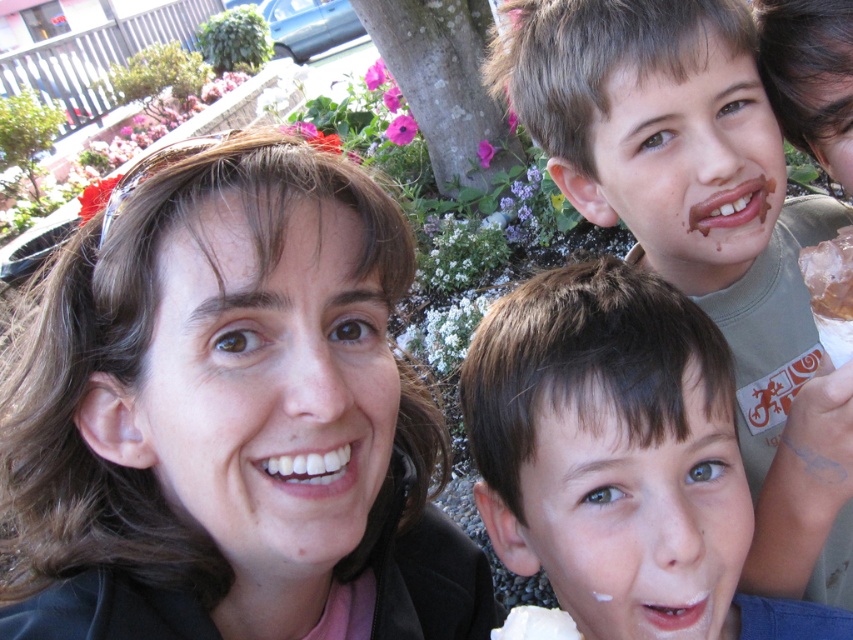
You are a photographer trying to capture a candid shot of the three people in the scene. You notice the black leather jacket at center and the chocolate ice cream at right. Which object is wider in the image?

The black leather jacket at center is wider than the chocolate ice cream at right according to the description.

You are holding a 20 inch ruler and want to measure the distance between yourself and the chocolate ice cream at right. Can you reach it without moving your hand?

The chocolate ice cream at right is 23.26 inches away from viewer. Since the ruler is only 20 inches long, you cannot reach it without moving your hand.